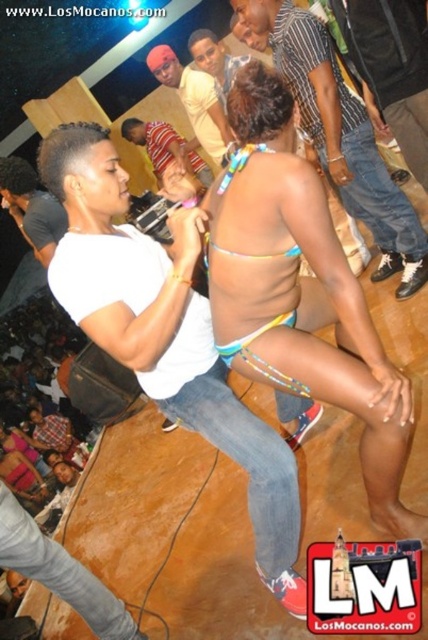
You are at a dance event and want to take a photo of the dancer wearing both the multicolored string bikini at center and the striped jersey at center. Based on their positions, can you see both items in the same frame?

The multicolored string bikini at center is below the striped jersey at center, so yes, both items are positioned in a way that they can be captured in the same frame as they are vertically aligned.

You are at a dance event and want to take a photo of the dancer. The multicolored fabric bikini top at center and striped shirt at upper center are both in your view. Which object should you focus on if you want to capture the dancer in the foreground?

You should focus on the multicolored fabric bikini top at center because it is below the striped shirt at upper center, indicating it is closer to the foreground.

You are organizing a costume party and need to decide which outfit to display in a narrow showcase. The showcase can only accommodate items narrower than 30 cm. Given the multicolored string bikini at center and the striped jersey at center, which one would fit better?

The multicolored string bikini at center has a width less than the striped jersey at center, so it would fit better in the narrow showcase since it is narrower than 30 cm.